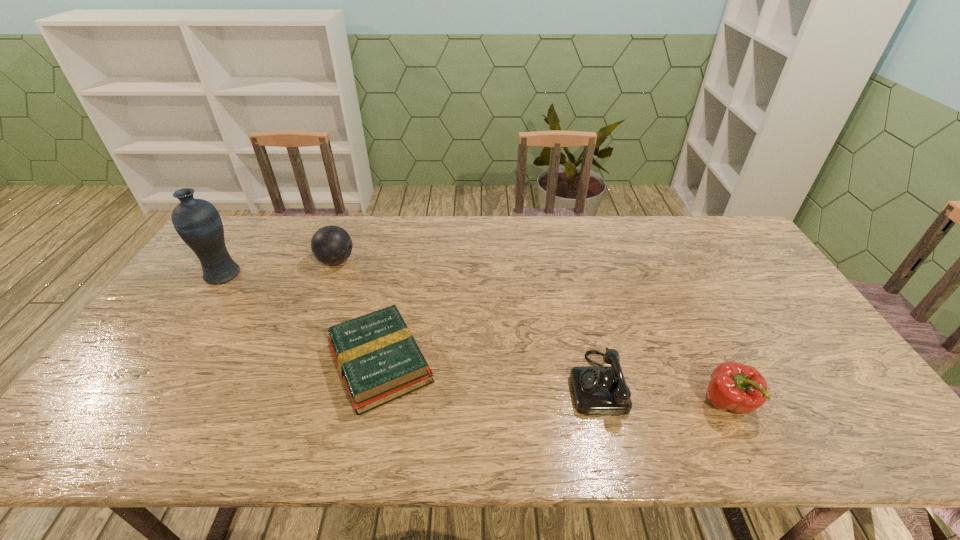
This screenshot has width=960, height=540. In order to click on free location located on the right of the pepper in this screenshot , I will do `click(812, 403)`.

Where is `vacant space located on the dial of the second shortest object`? vacant space located on the dial of the second shortest object is located at coordinates (498, 383).

At what (x,y) coordinates should I click in order to perform the action: click on vacant point located 0.320m on the dial of the second shortest object. Please return your answer as a coordinate pair (x, y). The width and height of the screenshot is (960, 540). Looking at the image, I should click on (443, 383).

The width and height of the screenshot is (960, 540). In order to click on vacant space located on the dial of the second shortest object in this screenshot , I will do coord(458,383).

Identify the location of vacant region located 0.290m on the left of the shortest object. The image size is (960, 540). (211, 363).

You are a GUI agent. You are given a task and a screenshot of the screen. Output one action in this format:
    pyautogui.click(x=<x>, y=<y>)
    Task: Click on the object present at the far edge
    
    Given the screenshot: What is the action you would take?
    pyautogui.click(x=331, y=245)

You are a GUI agent. You are given a task and a screenshot of the screen. Output one action in this format:
    pyautogui.click(x=<x>, y=<y>)
    Task: Click on the pepper that is positioned at the near edge
    The width and height of the screenshot is (960, 540).
    Given the screenshot: What is the action you would take?
    pyautogui.click(x=740, y=388)

Locate an element on the screen. Image resolution: width=960 pixels, height=540 pixels. telephone at the near edge is located at coordinates (597, 390).

In order to click on hardback book at the near edge in this screenshot , I will do `click(378, 359)`.

This screenshot has width=960, height=540. What are the coordinates of `object that is at the left edge` in the screenshot? It's located at (197, 221).